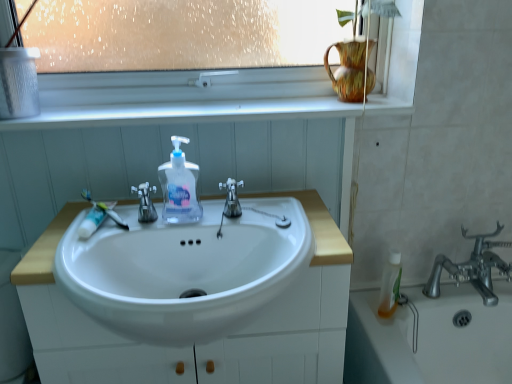
Describe the element at coordinates (197, 345) in the screenshot. I see `white glossy cabinet at center` at that location.

The image size is (512, 384). What do you see at coordinates (104, 209) in the screenshot? I see `white plastic toothbrush at left` at bounding box center [104, 209].

In order to face white plastic toothbrush at left, should I rotate leftwards or rightwards?

Rotate your view left by about 19.710°.

Identify the location of transparent plastic soap dispenser at center. (179, 187).

What is the approximate height of white matte toothpaste at left?

It is 1.58 inches.

This screenshot has height=384, width=512. In order to click on white matte toothpaste at left in this screenshot , I will do `click(92, 221)`.

Consider the image. Measure the distance between point (50, 115) and camera.

They are 3.72 feet apart.

What is the approximate height of polished chrome faucet at center, the second tap positioned from the left?

3.51 inches.

Where is `translucent plastic mouthwash at lower right`? The image size is (512, 384). translucent plastic mouthwash at lower right is located at coordinates (390, 285).

Is white glossy window sill at upper center facing towards white matte toothpaste at left?

No.

From the image's perspective, between white glossy window sill at upper center and white matte toothpaste at left, who is located below?

white matte toothpaste at left, from the image's perspective.

Who is taller, white glossy window sill at upper center or white matte toothpaste at left?

With more height is white matte toothpaste at left.

Considering the points (325, 109) and (92, 217), which point is in front, point (325, 109) or point (92, 217)?

The point (92, 217) is closer.

Is transparent plastic soap dispenser at center located within white matte toothpaste at left?

Actually, transparent plastic soap dispenser at center is outside white matte toothpaste at left.

Can you confirm if white matte toothpaste at left is wider than transparent plastic soap dispenser at center?

Yes.

Considering the positions of point (99, 223) and point (198, 218), is point (99, 223) closer or farther from the camera than point (198, 218)?

Point (99, 223) is closer to the camera than point (198, 218).

Is white matte toothpaste at left beside transparent plastic soap dispenser at center?

white matte toothpaste at left is not next to transparent plastic soap dispenser at center, and they're not touching.

Is polished chrome faucet at center, the first tap viewed from the right, shorter than white glossy window sill at upper center?

Incorrect, the height of polished chrome faucet at center, the first tap viewed from the right, does not fall short of that of white glossy window sill at upper center.

Is polished chrome faucet at center, the first tap viewed from the right, touching white glossy window sill at upper center?

No, polished chrome faucet at center, the first tap viewed from the right, is not beside white glossy window sill at upper center.

What's the angular difference between polished chrome faucet at center, the second tap positioned from the left, and white glossy window sill at upper center's facing directions?

There is a 0.0368-degree angle between the facing directions of polished chrome faucet at center, the second tap positioned from the left, and white glossy window sill at upper center.

Is polished chrome faucet at center, the second tap positioned from the left, wider than white glossy window sill at upper center?

Incorrect, the width of polished chrome faucet at center, the second tap positioned from the left, does not surpass that of white glossy window sill at upper center.

Does point (372, 109) appear closer or farther from the camera than point (230, 203)?

Point (372, 109) is positioned farther from the camera compared to point (230, 203).

How many degrees apart are the facing directions of white glossy window sill at upper center and polished chrome faucet at center, the first tap viewed from the right?

The facing directions of white glossy window sill at upper center and polished chrome faucet at center, the first tap viewed from the right, are 0.0368 degrees apart.

Is white glossy window sill at upper center outside of polished chrome faucet at center, the second tap positioned from the left?

Yes, white glossy window sill at upper center is not within polished chrome faucet at center, the second tap positioned from the left.

From the image's perspective, is white glossy window sill at upper center located beneath polished chrome faucet at center, the first tap viewed from the right?

Incorrect, from the image's perspective, white glossy window sill at upper center is higher than polished chrome faucet at center, the first tap viewed from the right.

Is the position of transparent plastic soap dispenser at center less distant than that of white plastic window frame at upper center?

→ Yes, the depth of transparent plastic soap dispenser at center is less than that of white plastic window frame at upper center.

Where is `window frame above the transparent plastic soap dispenser at center (from the image's perspective)`? This screenshot has width=512, height=384. window frame above the transparent plastic soap dispenser at center (from the image's perspective) is located at coordinates (183, 98).

Consider the image. Considering the sizes of objects white matte toothpaste at left and white glossy window sill at upper center in the image provided, who is smaller, white matte toothpaste at left or white glossy window sill at upper center?

Smaller between the two is white matte toothpaste at left.

Is point (95, 213) behind point (139, 122)?

No, it is not.

Is white matte toothpaste at left thinner than white glossy window sill at upper center?

Yes, white matte toothpaste at left is thinner than white glossy window sill at upper center.

Looking at this image, is satin nickel faucet at center, arranged as the second tap when viewed from the right, not within white glossy window sill at upper center?

satin nickel faucet at center, arranged as the second tap when viewed from the right, is positioned outside white glossy window sill at upper center.

Which point is more distant from viewer, (145, 203) or (46, 127)?

The point (46, 127) is more distant.

Which is more to the left, satin nickel faucet at center, acting as the first tap starting from the left, or white glossy window sill at upper center?

satin nickel faucet at center, acting as the first tap starting from the left, is more to the left.

The width and height of the screenshot is (512, 384). Identify the location of window sill behind the white matte toothpaste at left. (186, 113).

In order to click on toothpaste located below the transparent plastic soap dispenser at center (from the image's perspective) in this screenshot , I will do `click(92, 221)`.

Looking at the image, which one is located further to polished chrome faucet at center, the first tap viewed from the right, white plastic toothbrush at left or white plastic window frame at upper center?

white plastic window frame at upper center.

From the image, which object appears to be farther from white plastic toothbrush at left, white matte toothpaste at left or white plastic window frame at upper center?

white plastic window frame at upper center.

From the image, which object appears to be farther from white glossy window sill at upper center, transparent plastic soap dispenser at center or polished chrome faucet at center, the second tap positioned from the left?

Based on the image, polished chrome faucet at center, the second tap positioned from the left, appears to be further to white glossy window sill at upper center.

Estimate the real-world distances between objects in this image. Which object is further from transparent plastic soap dispenser at center, translucent plastic mouthwash at lower right or white plastic window frame at upper center?

Among the two, translucent plastic mouthwash at lower right is located further to transparent plastic soap dispenser at center.

Based on their spatial positions, is white matte toothpaste at left or polished chrome faucet at center, the first tap viewed from the right, closer to white plastic window frame at upper center?

polished chrome faucet at center, the first tap viewed from the right, is positioned closer to the anchor white plastic window frame at upper center.

Looking at the image, which one is located further to polished chrome faucet at center, the first tap viewed from the right, white plastic window frame at upper center or white plastic toothbrush at left?

white plastic window frame at upper center is further to polished chrome faucet at center, the first tap viewed from the right.

When comparing their distances from white plastic window frame at upper center, does white plastic toothbrush at left or translucent plastic mouthwash at lower right seem further?

translucent plastic mouthwash at lower right.

Considering their positions, is translucent plastic mouthwash at lower right positioned closer to satin nickel faucet at center, arranged as the second tap when viewed from the right, than white matte toothpaste at left?

The object closer to satin nickel faucet at center, arranged as the second tap when viewed from the right, is white matte toothpaste at left.

At what (x,y) coordinates should I click in order to perform the action: click on soap dispenser between white glossy window sill at upper center and white plastic toothbrush at left in the vertical direction. Please return your answer as a coordinate pair (x, y). Image resolution: width=512 pixels, height=384 pixels. Looking at the image, I should click on (179, 187).

I want to click on tap between polished chrome faucet at center, the first tap viewed from the right, and white glossy cabinet at center from top to bottom, so click(145, 202).

Locate an element on the screen. The height and width of the screenshot is (384, 512). tap between white plastic toothbrush at left and polished chrome faucet at center, the second tap positioned from the left, in the horizontal direction is located at coordinates (145, 202).

You are a GUI agent. You are given a task and a screenshot of the screen. Output one action in this format:
    pyautogui.click(x=<x>, y=<y>)
    Task: Click on the toothbrush between white plastic window frame at upper center and white matte toothpaste at left in the up-down direction
    This screenshot has height=384, width=512.
    Given the screenshot: What is the action you would take?
    tap(104, 209)